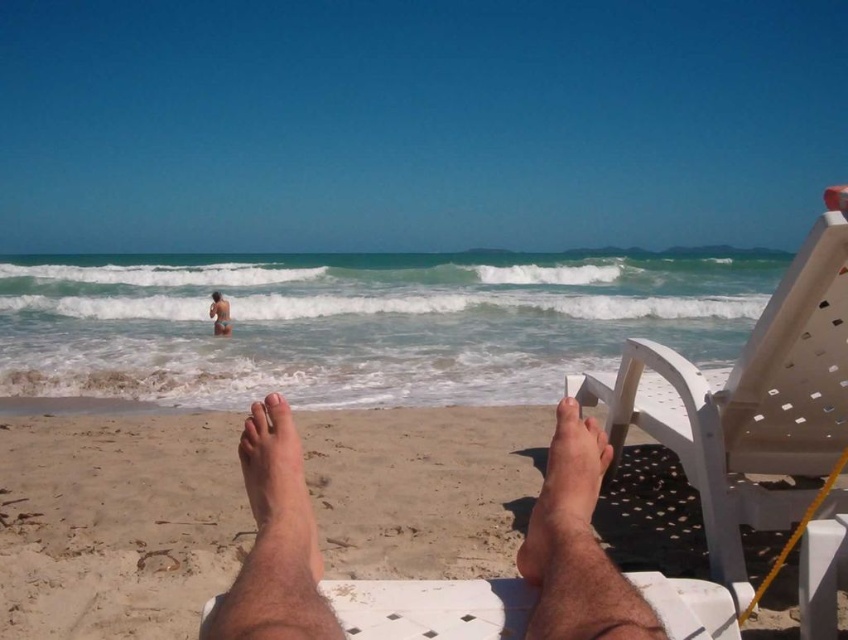
You are standing on the beach and see your dry skin at center. Where exactly is your dry skin located in relation to the white plastic beach chair?

The dry skin at center is located at point 0.795 on the x axis and 0.671 on the y axis relative to the white plastic beach chair.

You are at the beach and want to apply sunscreen to both the dry skin at center and the pale skin at center. Which area requires a larger sunscreen application area?

The pale skin at center requires a larger sunscreen application area because its width is greater than the dry skin at center.

You are standing on the beach and see the pale skin at center and the skinny bikini at lower center. Which object is closer to you?

The pale skin at center is closer to you because it is in front of the skinny bikini at lower center.